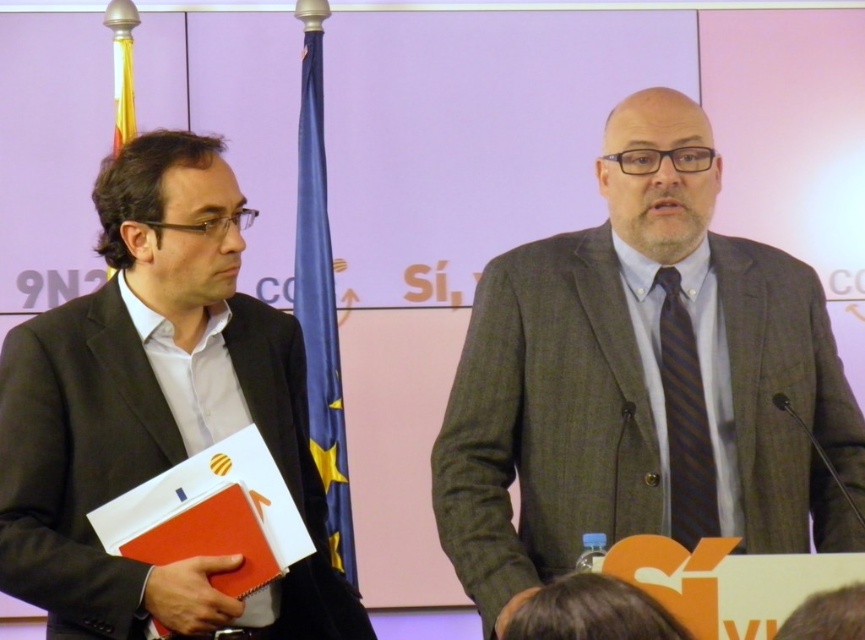
Does matte black suit at left have a greater width compared to dark blue striped tie at center?

Yes, matte black suit at left is wider than dark blue striped tie at center.

What do you see at coordinates (157, 410) in the screenshot?
I see `matte black suit at left` at bounding box center [157, 410].

At what (x,y) coordinates should I click in order to perform the action: click on matte black suit at left. Please return your answer as a coordinate pair (x, y). The height and width of the screenshot is (640, 865). Looking at the image, I should click on (157, 410).

Is gray wool suit at center shorter than matte black suit at left?

In fact, gray wool suit at center may be taller than matte black suit at left.

Does gray wool suit at center come in front of matte black suit at left?

Yes, it is in front of matte black suit at left.

Is point (714, 292) farther from camera compared to point (24, 552)?

That is True.

What are the coordinates of `gray wool suit at center` in the screenshot? It's located at (644, 381).

Who is positioned more to the left, gray wool suit at center or dark blue striped tie at center?

Positioned to the left is gray wool suit at center.

The height and width of the screenshot is (640, 865). In order to click on gray wool suit at center in this screenshot , I will do `click(644, 381)`.